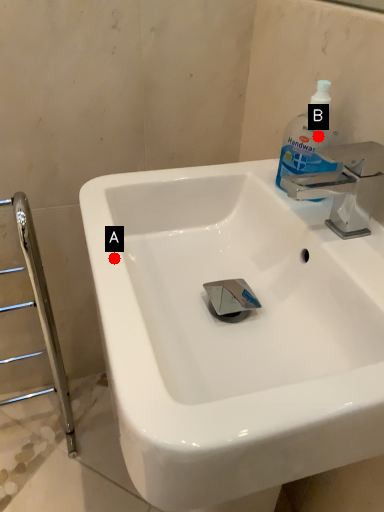
Question: Two points are circled on the image, labeled by A and B beside each circle. Which of the following is the closest to the observer?

Choices:
 (A) A is closer
 (B) B is closer

Answer: (A)